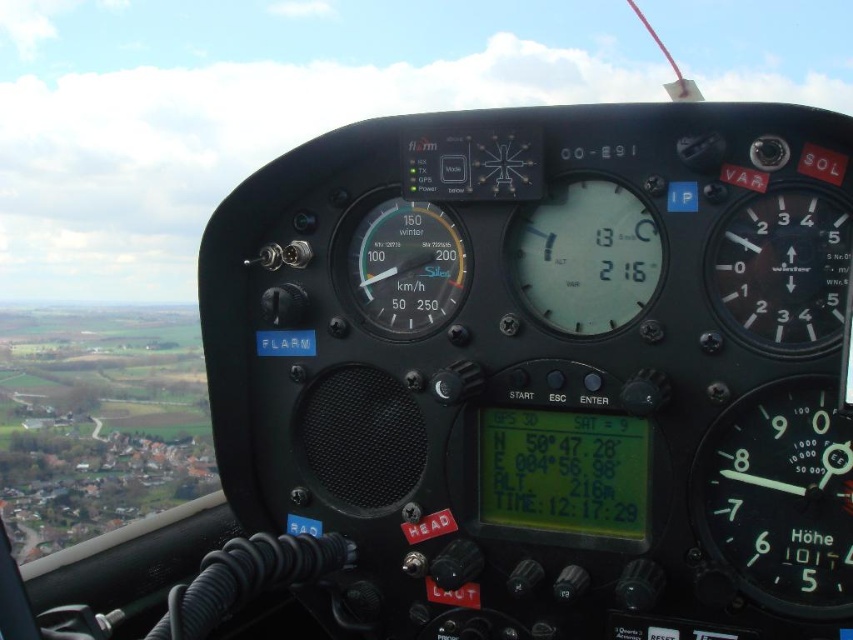
Consider the image. Can you confirm if transparent glass altimeter at center is positioned below matte black speedometer at center?

No, transparent glass altimeter at center is not below matte black speedometer at center.

Between transparent glass altimeter at center and matte black speedometer at center, which one is positioned higher?

transparent glass altimeter at center

This screenshot has width=853, height=640. What do you see at coordinates (585, 257) in the screenshot? I see `transparent glass altimeter at center` at bounding box center [585, 257].

At what (x,y) coordinates should I click in order to perform the action: click on transparent glass altimeter at center. Please return your answer as a coordinate pair (x, y). Looking at the image, I should click on (585, 257).

Is white illuminated needle at right smaller than matte black speedometer at center?

Actually, white illuminated needle at right might be larger than matte black speedometer at center.

Consider the image. Is white illuminated needle at right positioned before matte black speedometer at center?

That is True.

Does point (775, 497) come farther from viewer compared to point (432, 262)?

No, it is not.

Find the location of a particular element. The image size is (853, 640). white illuminated needle at right is located at coordinates (780, 497).

Between point (798, 333) and point (613, 252), which one is positioned behind?

Positioned behind is point (613, 252).

Is point (799, 192) farther from camera compared to point (592, 252)?

No, it is not.

Locate an element on the screen. The width and height of the screenshot is (853, 640). black matte gauge at upper right is located at coordinates (x=782, y=269).